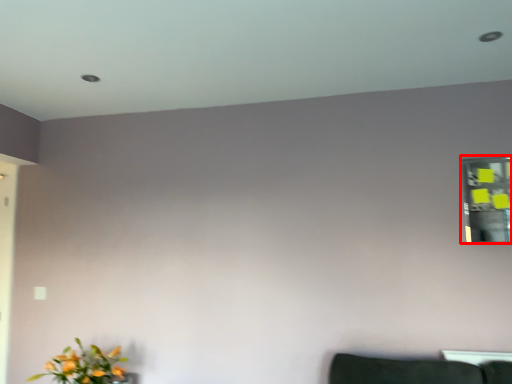
Question: From the image's perspective, considering the relative positions of mirror (annotated by the red box) and flower in the image provided, where is mirror (annotated by the red box) located with respect to the staircase?

Choices:
 (A) below
 (B) above

Answer: (B)